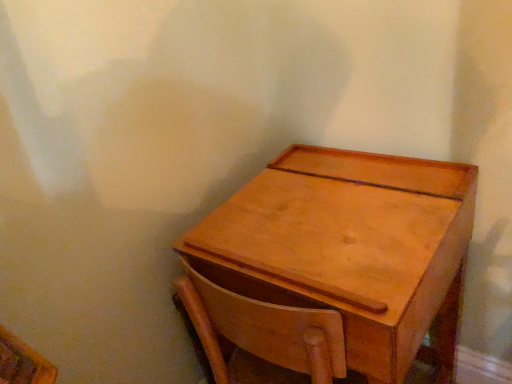
Looking at this image, measure the distance between point (x=368, y=184) and camera.

36.54 inches.

Identify the location of light brown wood table at center. The image size is (512, 384). (351, 248).

Describe the element at coordinates (351, 248) in the screenshot. I see `light brown wood table at center` at that location.

What is the approximate width of light brown wood table at center?

19.04 inches.

This screenshot has height=384, width=512. Find the location of `light brown wood table at center`. light brown wood table at center is located at coordinates (351, 248).